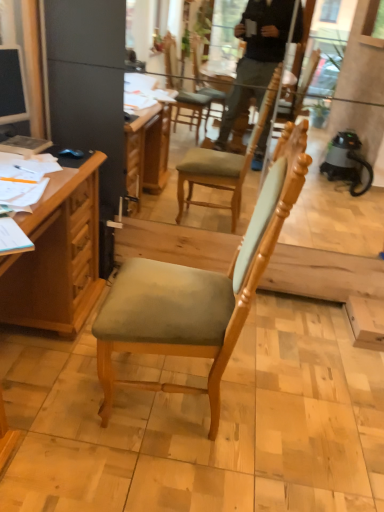
Question: Is there a large distance between blue matte computer mouse at upper left and light brown wood chair at center?

Choices:
 (A) yes
 (B) no

Answer: (B)

Question: Can you confirm if blue matte computer mouse at upper left is thinner than light brown wood chair at center?

Choices:
 (A) yes
 (B) no

Answer: (A)

Question: Does blue matte computer mouse at upper left appear on the left side of light brown wood chair at center?

Choices:
 (A) no
 (B) yes

Answer: (B)

Question: Is blue matte computer mouse at upper left wider than light brown wood chair at center?

Choices:
 (A) no
 (B) yes

Answer: (A)

Question: Can you confirm if blue matte computer mouse at upper left is taller than light brown wood chair at center?

Choices:
 (A) yes
 (B) no

Answer: (B)

Question: Choose the correct answer: Is blue matte computer mouse at upper left inside wooden desk at left or outside it?

Choices:
 (A) outside
 (B) inside

Answer: (A)

Question: Considering the positions of point (66, 148) and point (66, 202), is point (66, 148) closer or farther from the camera than point (66, 202)?

Choices:
 (A) closer
 (B) farther

Answer: (B)

Question: From the image's perspective, relative to wooden desk at left, is blue matte computer mouse at upper left above or below?

Choices:
 (A) below
 (B) above

Answer: (B)

Question: In terms of size, does blue matte computer mouse at upper left appear bigger or smaller than wooden desk at left?

Choices:
 (A) small
 (B) big

Answer: (A)

Question: From the image's perspective, is blue matte computer mouse at upper left positioned above or below hardcover book at left?

Choices:
 (A) below
 (B) above

Answer: (A)

Question: Is point (79, 150) closer or farther from the camera than point (44, 145)?

Choices:
 (A) closer
 (B) farther

Answer: (B)

Question: From a real-world perspective, is blue matte computer mouse at upper left above or below hardcover book at left?

Choices:
 (A) below
 (B) above

Answer: (B)

Question: Would you say blue matte computer mouse at upper left is to the left or to the right of hardcover book at left in the picture?

Choices:
 (A) left
 (B) right

Answer: (B)

Question: In the image, is hardcover book at left on the left side or the right side of blue matte computer mouse at upper left?

Choices:
 (A) right
 (B) left

Answer: (B)

Question: From the image's perspective, is hardcover book at left above or below blue matte computer mouse at upper left?

Choices:
 (A) below
 (B) above

Answer: (B)